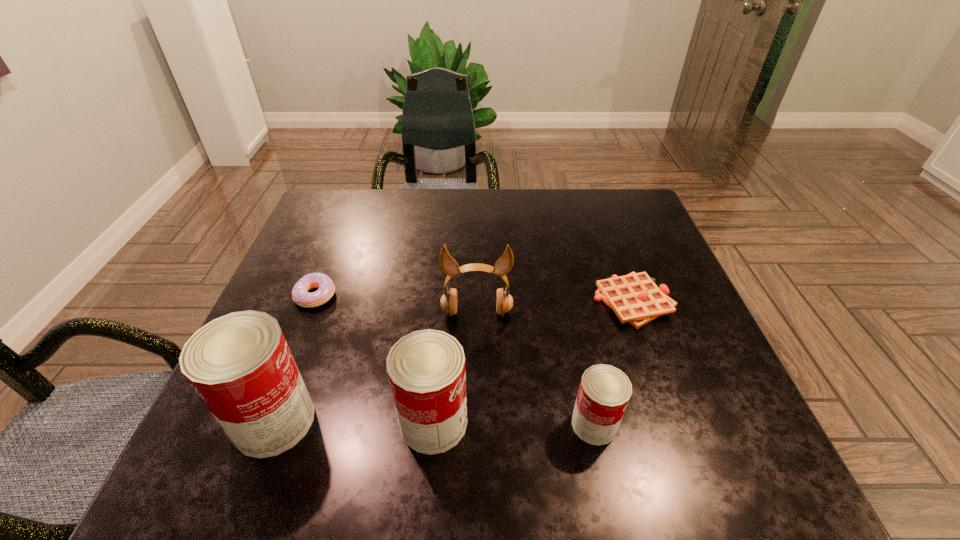
Please point a spot on the right to add another can. Please provide its 2D coordinates. Your answer should be formatted as a tuple, i.e. [(x, y)], where the tuple contains the x and y coordinates of a point satisfying the conditions above.

[(756, 426)]